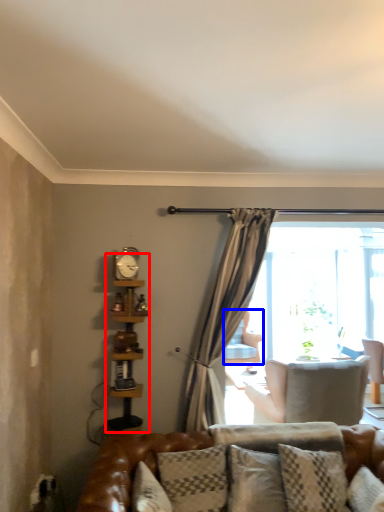
Question: Which of the following is the closest to the observer, bookshelf (highlighted by a red box) or chair (highlighted by a blue box)?

Choices:
 (A) bookshelf
 (B) chair

Answer: (A)